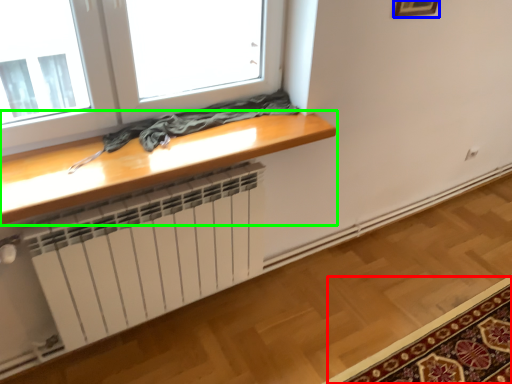
Question: Which is nearer to the mat (highlighted by a red box)? picture frame (highlighted by a blue box) or table (highlighted by a green box).

Choices:
 (A) picture frame
 (B) table

Answer: (B)